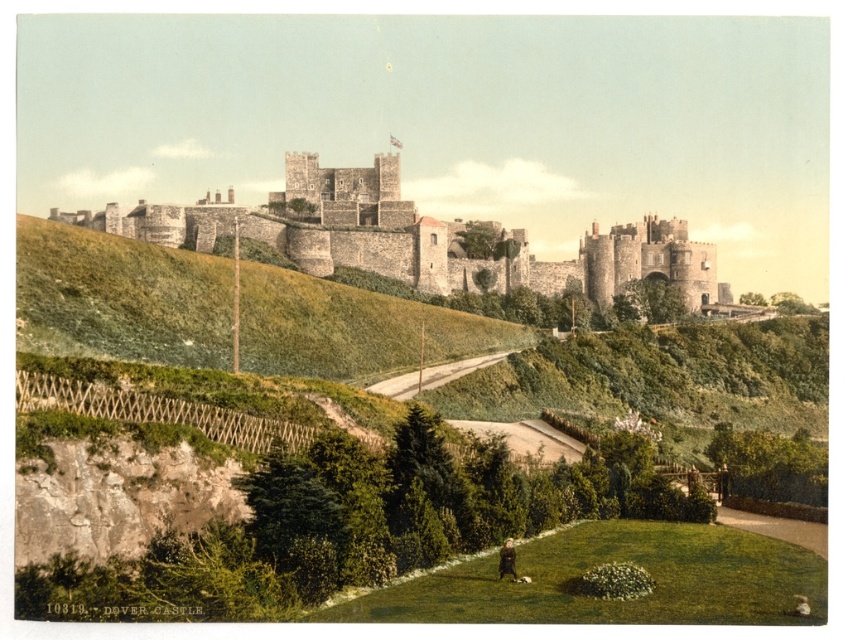
Question: Does green grassy hillside at upper center come in front of brown fur dog at lower center?

Choices:
 (A) yes
 (B) no

Answer: (B)

Question: Which point is farther to the camera?

Choices:
 (A) (512, 552)
 (B) (196, 209)
 (C) (458, 355)

Answer: (B)

Question: Which of the following is the closest to the observer?

Choices:
 (A) (501, 573)
 (B) (45, 310)
 (C) (499, 260)

Answer: (A)

Question: Based on their relative distances, which object is farther from the stone castle at center?

Choices:
 (A) green grassy hillside at upper center
 (B) brown fur dog at lower center

Answer: (B)

Question: Does stone castle at center have a greater width compared to brown fur dog at lower center?

Choices:
 (A) yes
 (B) no

Answer: (A)

Question: Is green grassy hillside at upper center below brown fur dog at lower center?

Choices:
 (A) yes
 (B) no

Answer: (B)